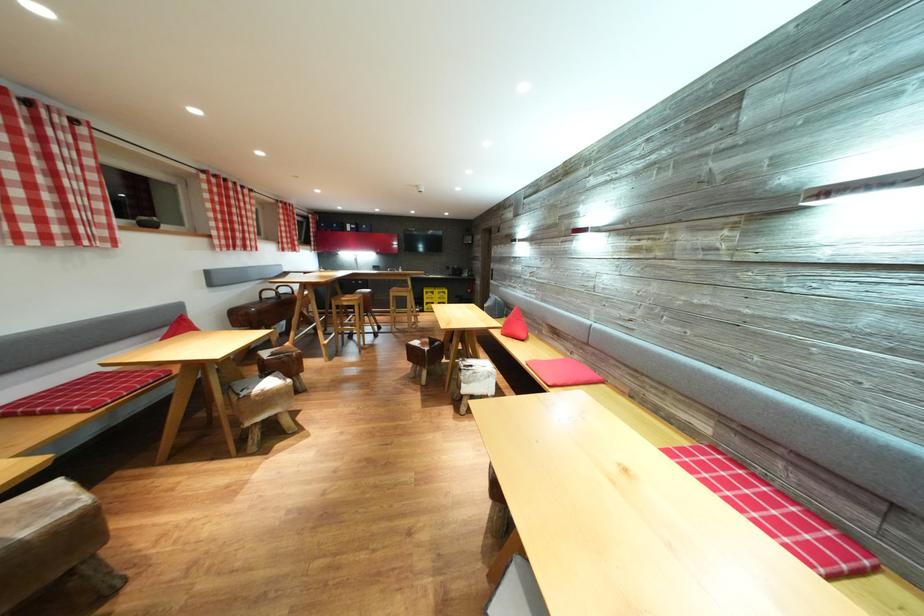
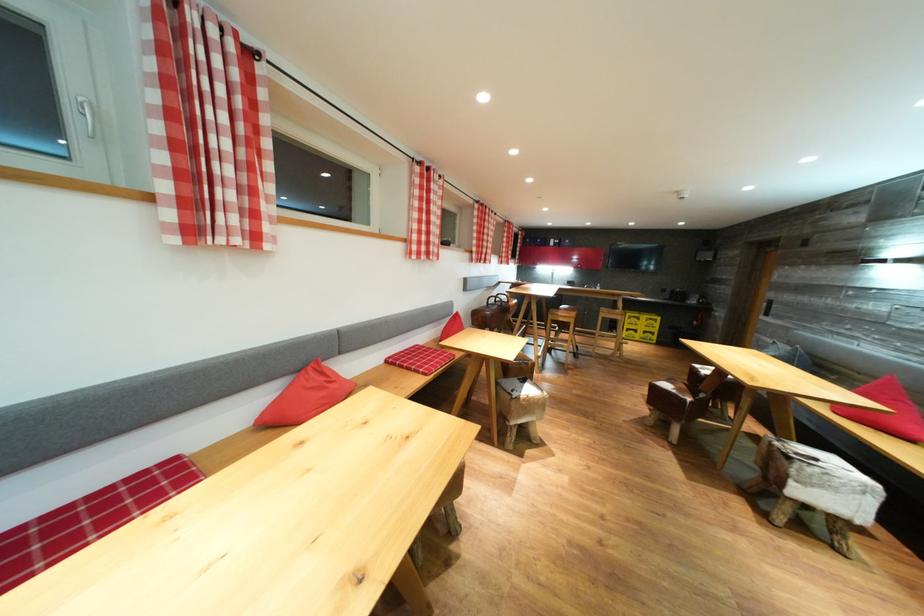
Question: Based on the continuous images, in which direction is the camera rotating? Reply with the corresponding letter.

Choices:
 (A) Left
 (B) Right
 (C) Up
 (D) Down

Answer: (A)